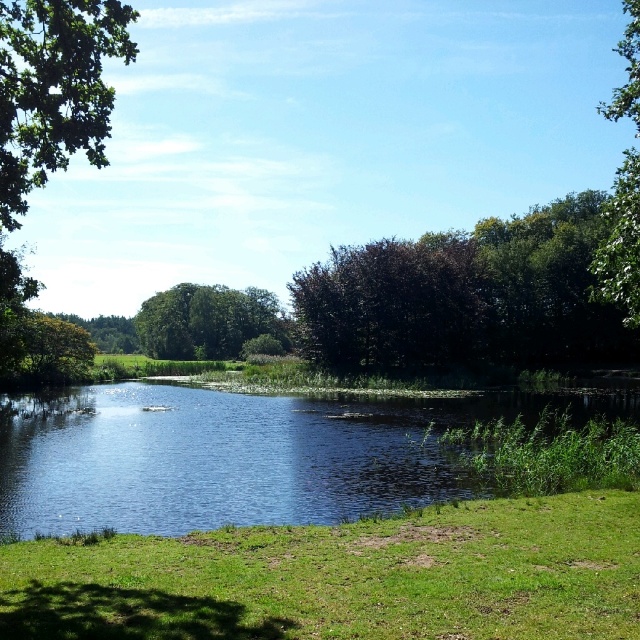
Question: Which of the following is the closest to the observer?

Choices:
 (A) (19, 97)
 (B) (157, 348)
 (C) (472, 481)

Answer: (A)

Question: Can you confirm if green grassy at lower center is bigger than green leafy tree at upper left?

Choices:
 (A) no
 (B) yes

Answer: (A)

Question: Can you confirm if green leafy tree at center is positioned to the left of green leafy tree at upper right?

Choices:
 (A) yes
 (B) no

Answer: (A)

Question: Which point is farther from the camera taking this photo?

Choices:
 (A) (321, 592)
 (B) (145, 486)

Answer: (B)

Question: Is green leafy tree at upper left in front of green leafy tree at upper right?

Choices:
 (A) yes
 (B) no

Answer: (A)

Question: Among these objects, which one is nearest to the camera?

Choices:
 (A) green grassy at lower center
 (B) green leafy tree at center
 (C) clear blue water at center

Answer: (A)